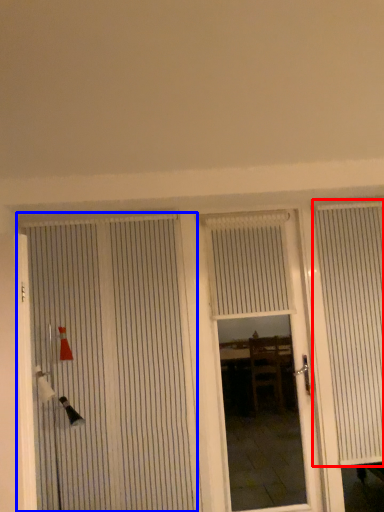
Question: Which of the following is the farthest to the observer, curtain (highlighted by a red box) or door (highlighted by a blue box)?

Choices:
 (A) curtain
 (B) door

Answer: (A)